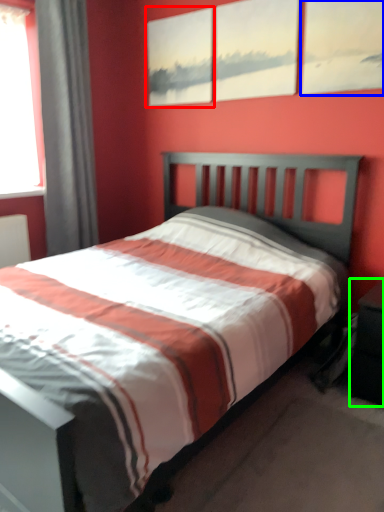
Question: Which object is the closest to the picture frame (highlighted by a red box)? Choose among these: picture frame (highlighted by a blue box) or nightstand (highlighted by a green box).

Choices:
 (A) picture frame
 (B) nightstand

Answer: (A)